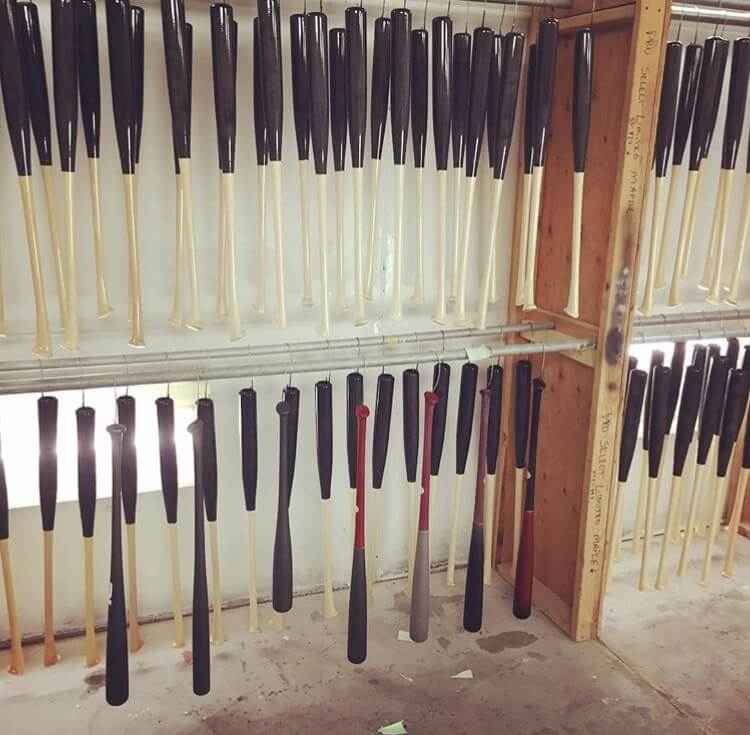
The height and width of the screenshot is (735, 750). Find the location of `rack`. rack is located at coordinates (250, 375).